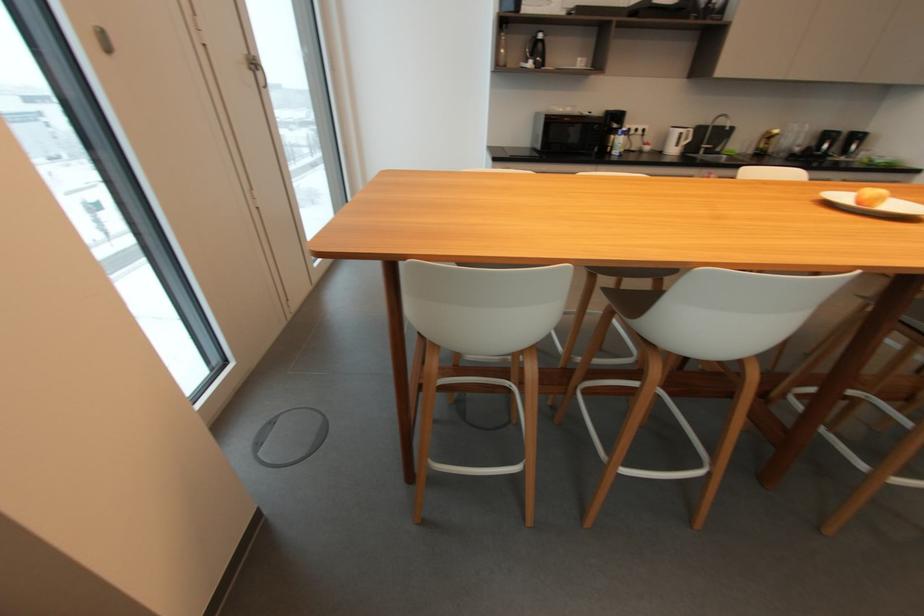
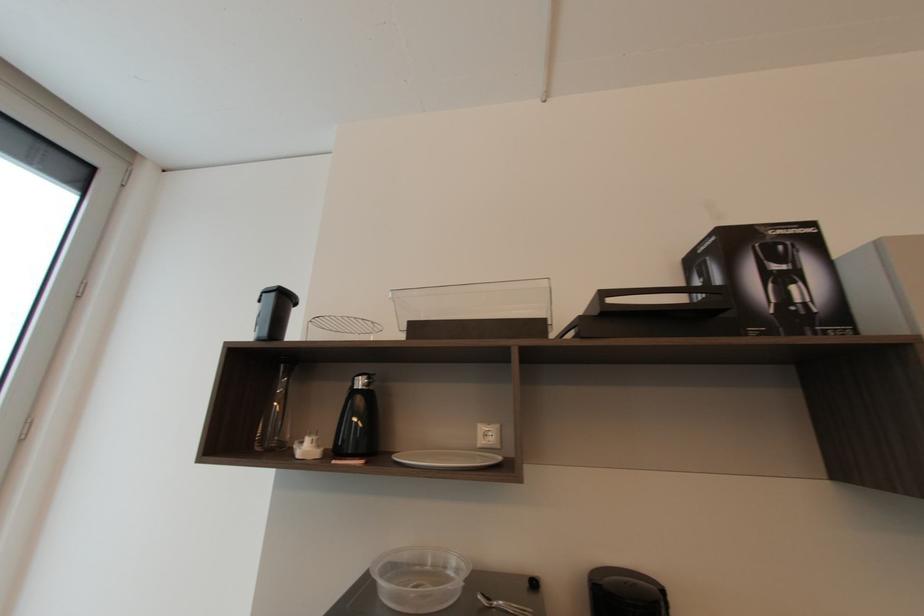
In the second image, find the point that corresponds to (544,36) in the first image.

(362, 384)